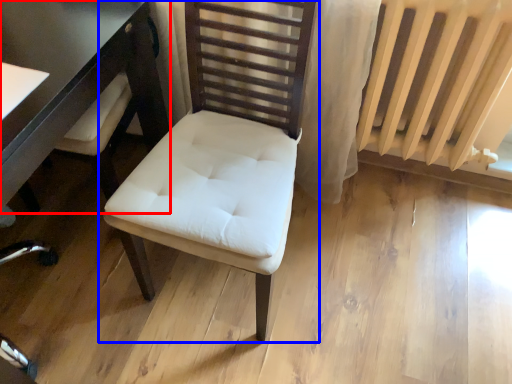
Question: Which point is closer to the camera, table (highlighted by a red box) or chair (highlighted by a blue box)?

Choices:
 (A) table
 (B) chair

Answer: (B)